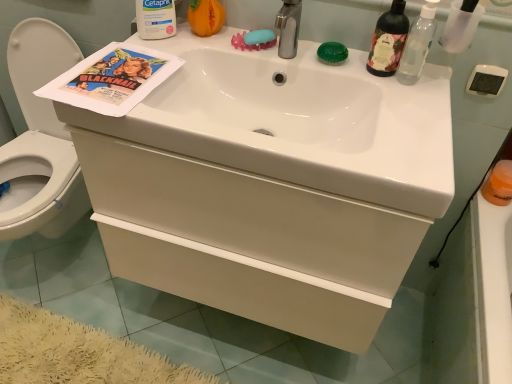
Locate an element on the screen. vacant area that lies between matte paper poster at upper left and white matte lotion at upper center, which is counted as the 3th bottle, starting from the right is located at coordinates (158, 46).